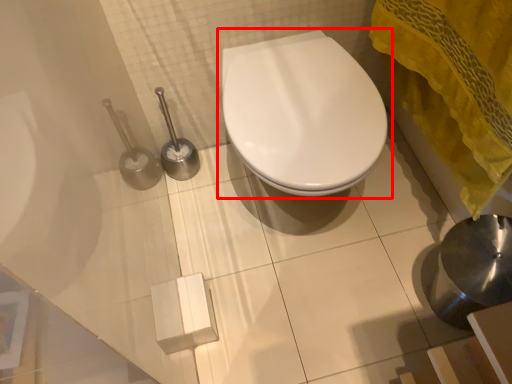
Question: Where is toilet (annotated by the red box) located in relation to bath towel in the image?

Choices:
 (A) left
 (B) right

Answer: (A)